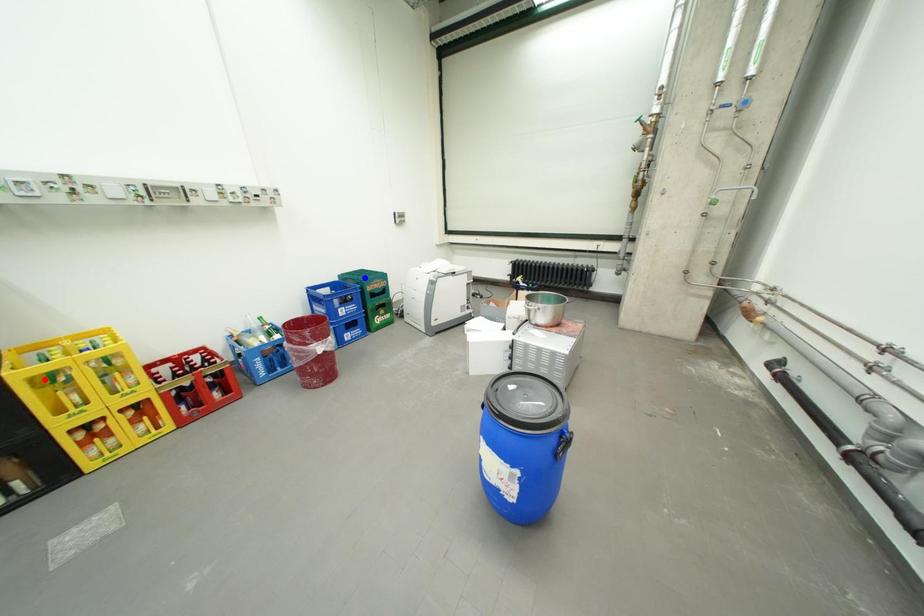
Question: Two points are marked on the image. Which point is closer to the camera?

Choices:
 (A) Blue point is closer.
 (B) Red point is closer.

Answer: (B)